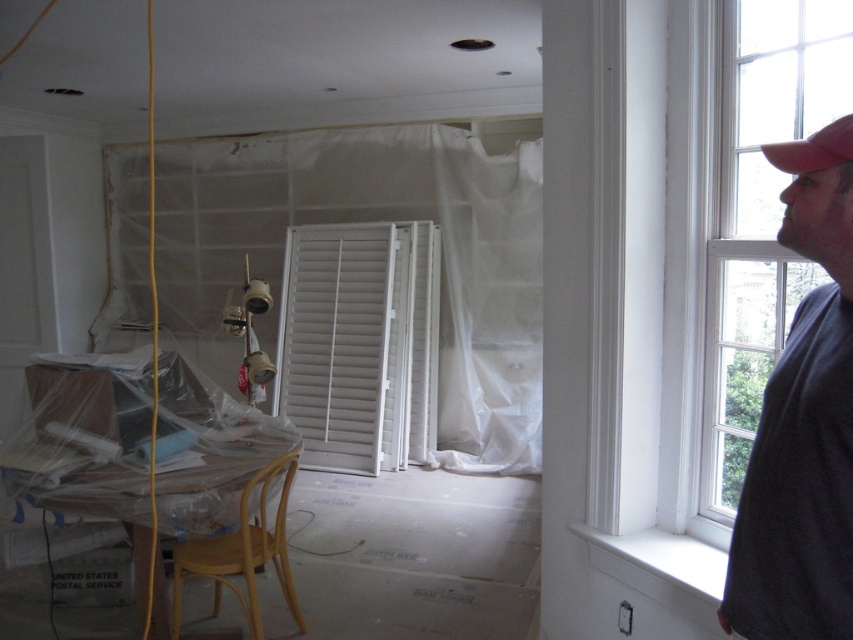
You are a contractor working in the room and need to locate the white matte shutters at center. According to the coordinates provided, where exactly are they positioned?

The white matte shutters at center are located at coordinates point (358, 342).